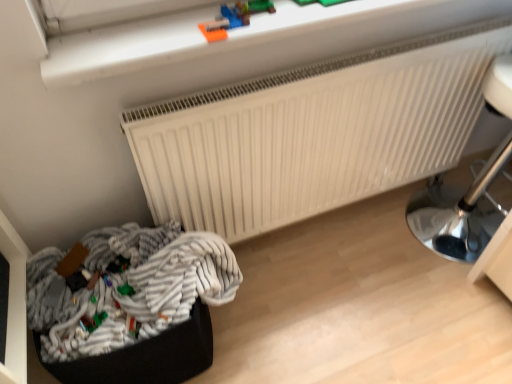
You are a GUI agent. You are given a task and a screenshot of the screen. Output one action in this format:
    pyautogui.click(x=<x>, y=<y>)
    Task: Click on the free spot below white matte radiator at upper center (from a real-world perspective)
    Image resolution: width=512 pixels, height=384 pixels.
    Given the screenshot: What is the action you would take?
    pyautogui.click(x=305, y=233)